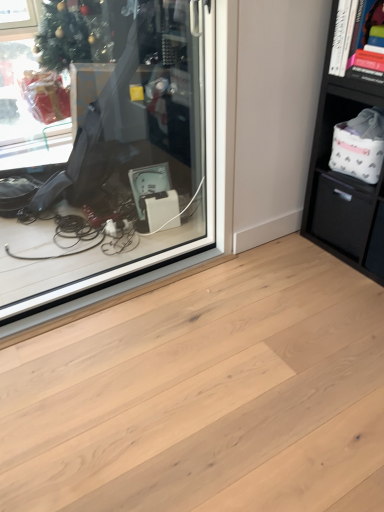
Question: Relative to black matte bookshelf at upper right, is transparent glass shop window at center in front or behind?

Choices:
 (A) front
 (B) behind

Answer: (A)

Question: In the image, is transparent glass shop window at center on the left side or the right side of black matte bookshelf at upper right?

Choices:
 (A) left
 (B) right

Answer: (A)

Question: Based on their relative distances, which object is farther from the black matte drawer at right?

Choices:
 (A) black matte bookshelf at upper right
 (B) transparent glass shop window at center
 (C) natural wood plank at center

Answer: (B)

Question: Considering the real-world distances, which object is farthest from the black matte drawer at right?

Choices:
 (A) natural wood plank at center
 (B) black matte bookshelf at upper right
 (C) transparent glass shop window at center

Answer: (C)